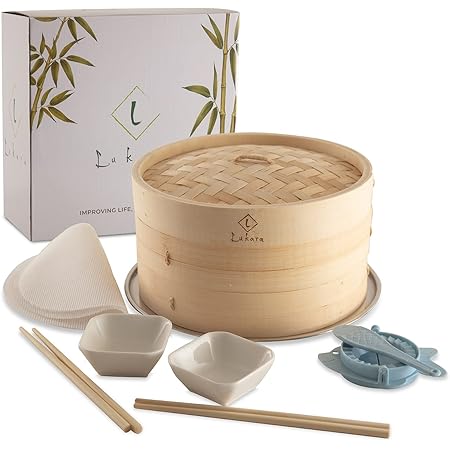
Where is `handle`? The height and width of the screenshot is (450, 450). handle is located at coordinates (250, 156).